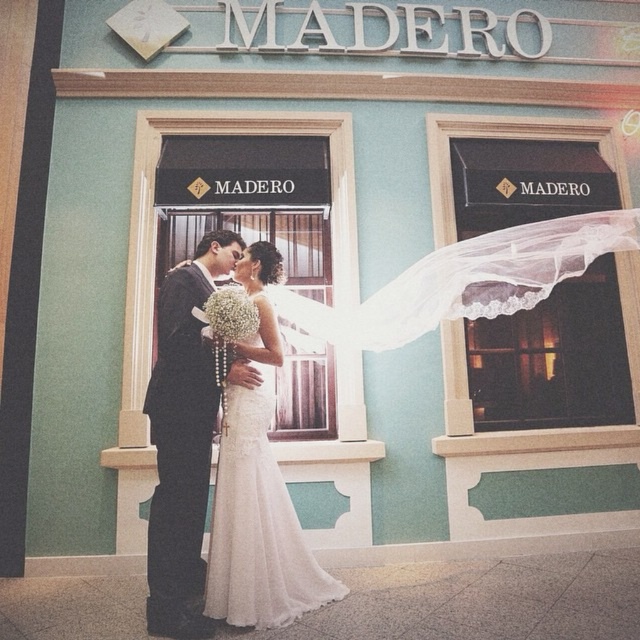
In the scene shown: Does matte black suit at center have a lesser height compared to white lace wedding dress at center?

Incorrect, matte black suit at center's height does not fall short of white lace wedding dress at center's.

Between matte black suit at center and white lace wedding dress at center, which one has more height?

matte black suit at center

Find the location of `matte black suit at center`. matte black suit at center is located at coordinates (182, 440).